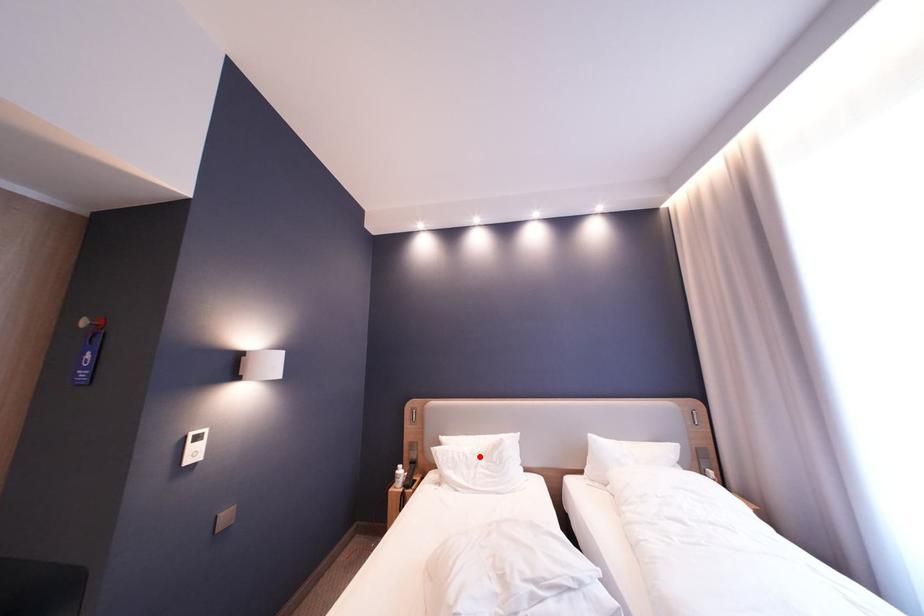
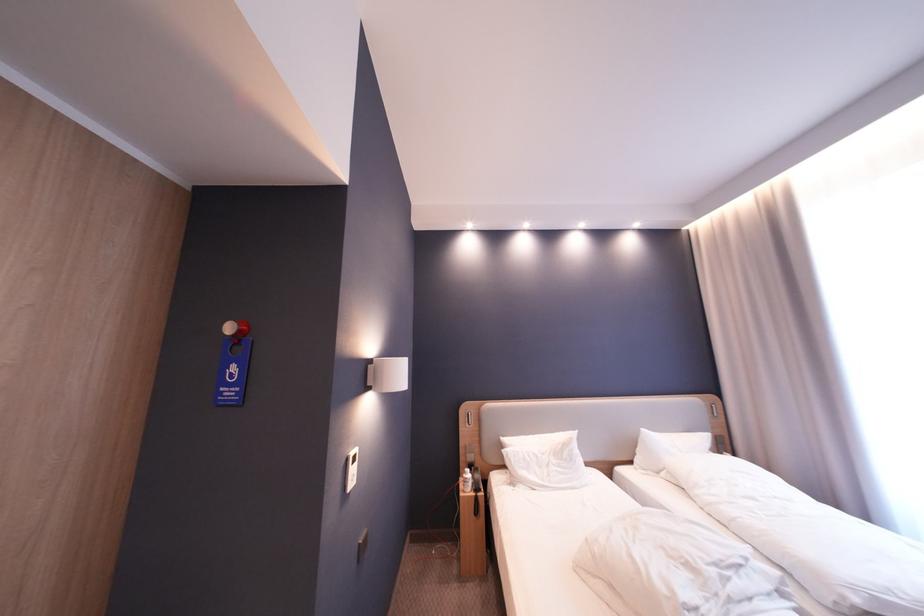
The point at the highlighted location is marked in the first image. Where is the corresponding point in the second image?

(550, 456)